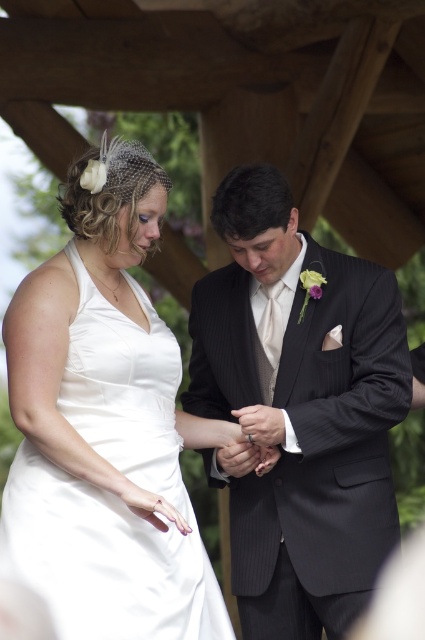
Question: Can you confirm if black pinstripe suit at center is wider than satin white dress at center?

Choices:
 (A) no
 (B) yes

Answer: (B)

Question: Estimate the real-world distances between objects in this image. Which object is closer to the black pinstripe suit at center?

Choices:
 (A) satin white dress at center
 (B) silver metallic ring at center

Answer: (A)

Question: Does satin white dress at center appear under silver metallic ring at center?

Choices:
 (A) yes
 (B) no

Answer: (B)

Question: Among these points, which one is nearest to the camera?

Choices:
 (A) pos(249,433)
 (B) pos(212,284)

Answer: (A)

Question: Can you confirm if black pinstripe suit at center is bigger than silver metallic ring at center?

Choices:
 (A) yes
 (B) no

Answer: (A)

Question: Which of the following is the closest to the observer?

Choices:
 (A) silver metallic ring at center
 (B) satin white dress at center

Answer: (B)